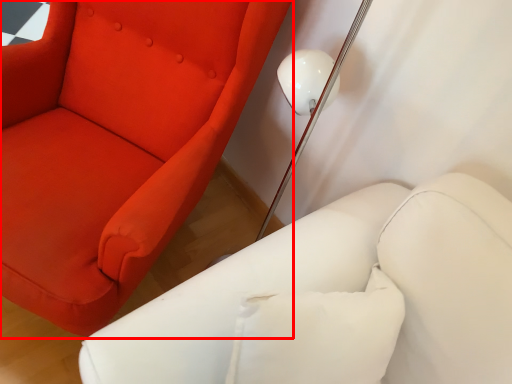
Question: From the image's perspective, considering the relative positions of chair (annotated by the red box) and furniture in the image provided, where is chair (annotated by the red box) located with respect to the staircase?

Choices:
 (A) below
 (B) above

Answer: (B)